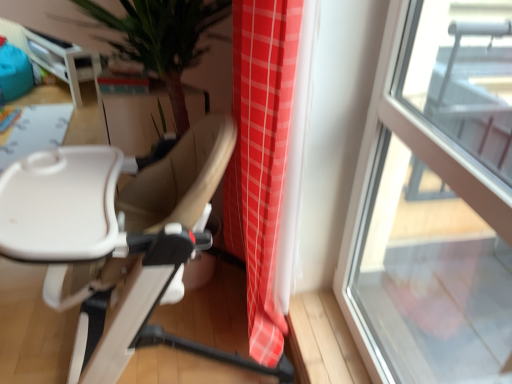
Identify the location of transparent glass window at right. (435, 200).

Considering the relative sizes of beige leather chair at center and transparent glass window at right in the image provided, is beige leather chair at center wider than transparent glass window at right?

Correct, the width of beige leather chair at center exceeds that of transparent glass window at right.

Is beige leather chair at center positioned in front of transparent glass window at right?

No, beige leather chair at center is further to the viewer.

From their relative heights in the image, would you say beige leather chair at center is taller or shorter than transparent glass window at right?

In the image, beige leather chair at center appears to be shorter than transparent glass window at right.

Would you consider transparent glass window at right to be distant from white glossy table at upper left?

That's right, there is a large distance between transparent glass window at right and white glossy table at upper left.

Is point (460, 310) more distant than point (78, 65)?

No, it is not.

Is transparent glass window at right oriented away from white glossy table at upper left?

No, transparent glass window at right is not facing the opposite direction of white glossy table at upper left.

In the image, is transparent glass window at right on the left side or the right side of white glossy table at upper left?

transparent glass window at right is positioned on white glossy table at upper left's right side.

Does white glossy table at upper left have a greater height compared to beige leather chair at center?

Yes.

Locate an element on the screen. This screenshot has height=384, width=512. chair located in front of the white glossy table at upper left is located at coordinates (82, 250).

Does white glossy table at upper left touch beige leather chair at center?

No.

Could beige leather chair at center be considered to be inside white glossy table at upper left?

No, beige leather chair at center is not surrounded by white glossy table at upper left.

In the scene shown: Does beige leather chair at center have a smaller size compared to white glossy table at upper left?

Actually, beige leather chair at center might be larger than white glossy table at upper left.

Is beige leather chair at center far away from white glossy table at upper left?

That's right, there is a large distance between beige leather chair at center and white glossy table at upper left.

Locate an element on the screen. The image size is (512, 384). table that appears on the left of beige leather chair at center is located at coordinates (63, 60).

Consider the image. Could you tell me if beige leather chair at center is turned towards white glossy table at upper left?

No, beige leather chair at center is not aimed at white glossy table at upper left.

This screenshot has height=384, width=512. I want to click on window lying in front of the white glossy table at upper left, so click(435, 200).

Is white glossy table at upper left inside the boundaries of transparent glass window at right, or outside?

white glossy table at upper left is not inside transparent glass window at right, it's outside.

Looking at the image, does white glossy table at upper left seem bigger or smaller compared to transparent glass window at right?

Clearly, white glossy table at upper left is larger in size than transparent glass window at right.

In the scene shown: From their relative heights in the image, would you say white glossy table at upper left is taller or shorter than transparent glass window at right?

Clearly, white glossy table at upper left is shorter compared to transparent glass window at right.

Can you confirm if transparent glass window at right is positioned to the left of beige leather chair at center?

No.

Which is closer, (376, 177) or (55, 185)?

Point (376, 177) appears to be farther away from the viewer than point (55, 185).

From a real-world perspective, is transparent glass window at right physically below beige leather chair at center?

No, from a real-world perspective, transparent glass window at right is not below beige leather chair at center.

Which of these two, transparent glass window at right or beige leather chair at center, is wider?

beige leather chair at center.

Image resolution: width=512 pixels, height=384 pixels. In order to click on chair behind the transparent glass window at right in this screenshot , I will do [82, 250].

Image resolution: width=512 pixels, height=384 pixels. Find the location of `table on the left of transparent glass window at right`. table on the left of transparent glass window at right is located at coordinates (63, 60).

Estimate the real-world distances between objects in this image. Which object is closer to transparent glass window at right, beige leather chair at center or white glossy table at upper left?

beige leather chair at center lies closer to transparent glass window at right than the other object.

In the scene shown: From the image, which object appears to be farther from beige leather chair at center, white glossy table at upper left or transparent glass window at right?

The object further to beige leather chair at center is white glossy table at upper left.

Looking at this image, estimate the real-world distances between objects in this image. Which object is closer to beige leather chair at center, transparent glass window at right or white glossy table at upper left?

Among the two, transparent glass window at right is located nearer to beige leather chair at center.

When comparing their distances from white glossy table at upper left, does transparent glass window at right or beige leather chair at center seem further?

Based on the image, transparent glass window at right appears to be further to white glossy table at upper left.

From the image, which object appears to be nearer to transparent glass window at right, white glossy table at upper left or beige leather chair at center?

beige leather chair at center is positioned closer to the anchor transparent glass window at right.

Looking at the image, which one is located further to white glossy table at upper left, beige leather chair at center or transparent glass window at right?

transparent glass window at right.

You are a GUI agent. You are given a task and a screenshot of the screen. Output one action in this format:
    pyautogui.click(x=<x>, y=<y>)
    Task: Click on the chair located between transparent glass window at right and white glossy table at upper left in the depth direction
    The height and width of the screenshot is (384, 512).
    Given the screenshot: What is the action you would take?
    pyautogui.click(x=82, y=250)